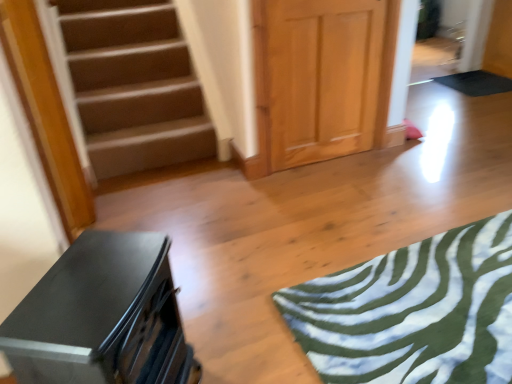
Where is `vacant space positioned to the left of light wood paneling at center`? vacant space positioned to the left of light wood paneling at center is located at coordinates (258, 182).